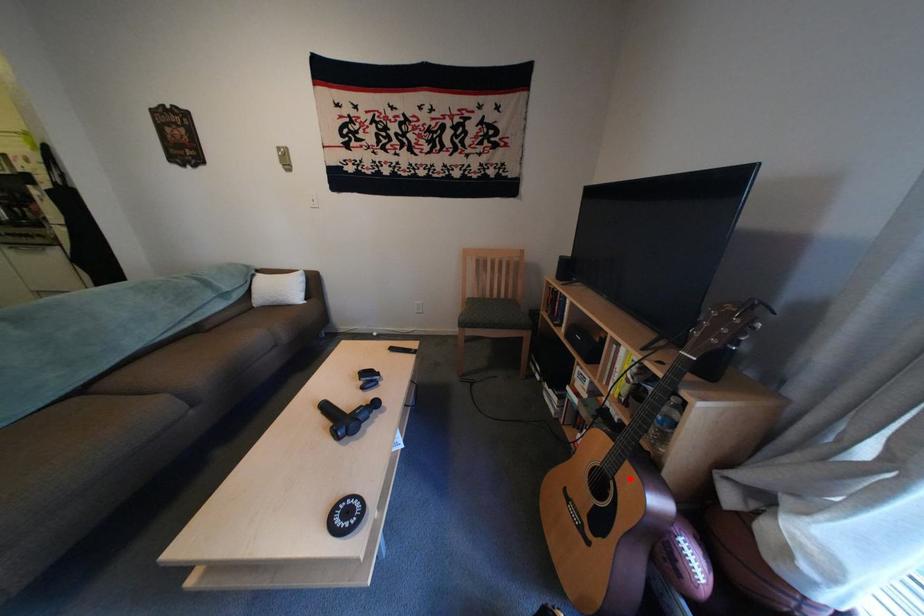
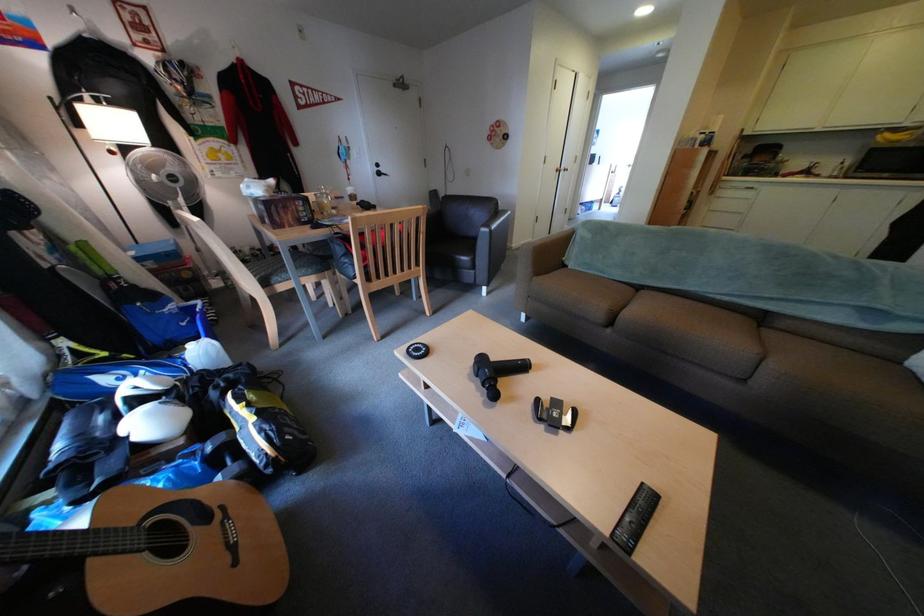
Question: I am providing you with two images of the same scene from different viewpoints. Given a red point in image1, look at the same physical point in image2. Is it:

Choices:
 (A) Closer to the viewpoint
 (B) Farther from the viewpoint

Answer: (B)